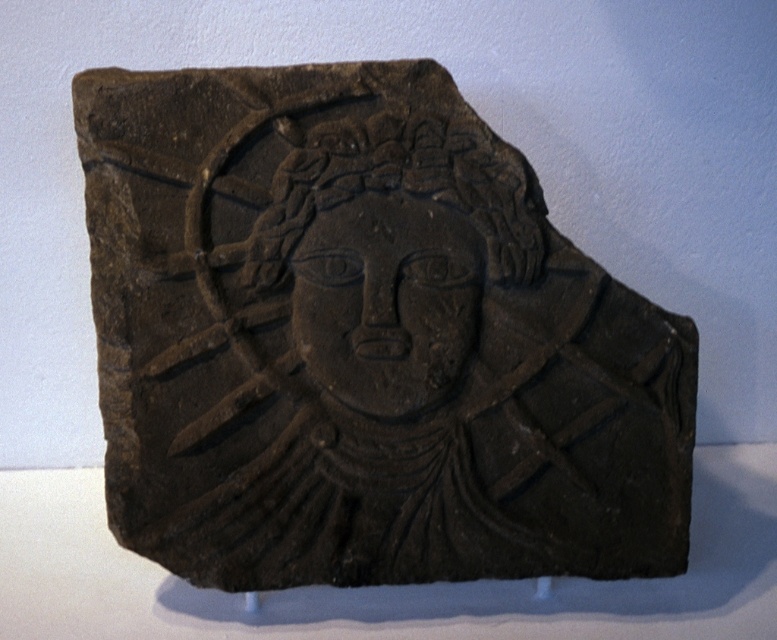
Is dark stone carving at center wider than matte black face at center?

Yes, dark stone carving at center is wider than matte black face at center.

Between point (476, 291) and point (370, 205), which one is positioned in front?

Positioned in front is point (476, 291).

Find the location of a particular element. This screenshot has height=640, width=777. dark stone carving at center is located at coordinates (364, 340).